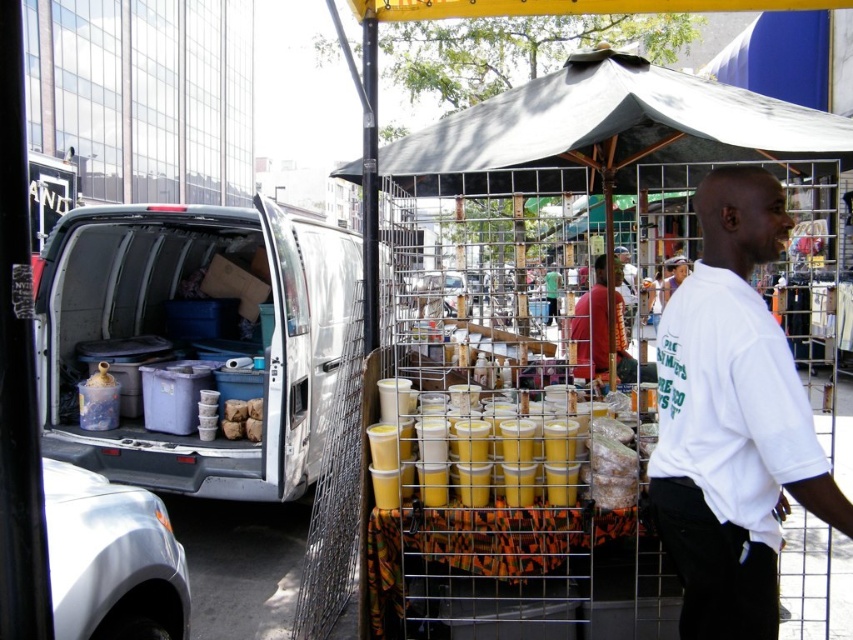
You are a customer at the food stall and want to grab a drink from the yellow plastic cups at center. However, there are matte plastic containers at rear blocking your way. Can you easily reach the cups without moving the containers?

The matte plastic containers at rear are located above the yellow plastic cups at center, so they are not blocking the path. You can easily reach the yellow plastic cups at center without moving the containers.

You are standing in the street scene and want to find the point at coordinates [732,420]. Which object in the scene is this point located on?

The point at coordinates [732,420] is located on the white cotton t shirt at center.